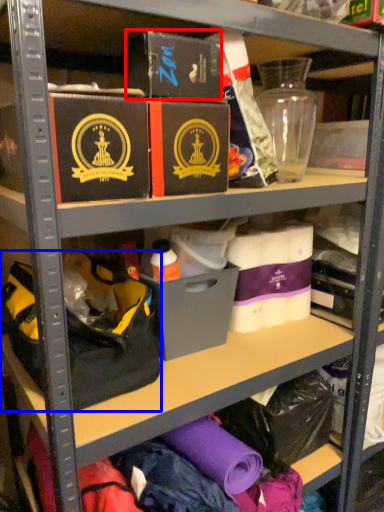
Question: Which point is further to the camera, box (highlighted by a red box) or handbag (highlighted by a blue box)?

Choices:
 (A) box
 (B) handbag

Answer: (B)